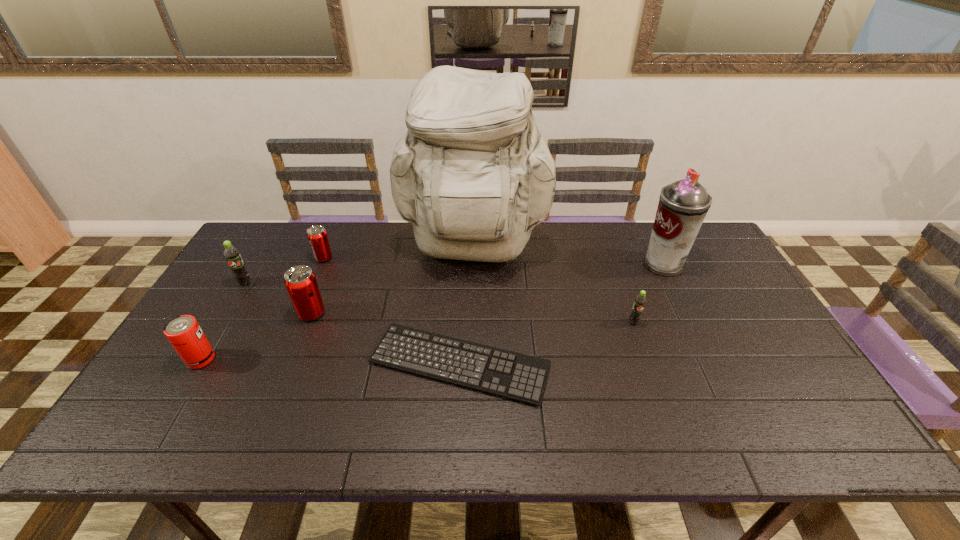
Select which object appears as the closest to the computer keyboard. Please provide its 2D coordinates. Your answer should be formatted as a tuple, i.e. [(x, y)], where the tuple contains the x and y coordinates of a point satisfying the conditions above.

[(300, 281)]

Locate an element on the screen. This screenshot has height=540, width=960. object that is the fourth closest to the black computer keyboard is located at coordinates (317, 236).

Identify the location of the closest soda to the aerosol can. (640, 301).

Select which soda appears as the closest to the second object from right to left. Please provide its 2D coordinates. Your answer should be formatted as a tuple, i.e. [(x, y)], where the tuple contains the x and y coordinates of a point satisfying the conditions above.

[(300, 281)]

The image size is (960, 540). Find the location of `vacant position in the image that satisfies the following two spatial constraints: 1. on the front label of the farther green soda; 2. on the left side of the black computer keyboard`. vacant position in the image that satisfies the following two spatial constraints: 1. on the front label of the farther green soda; 2. on the left side of the black computer keyboard is located at coordinates (196, 364).